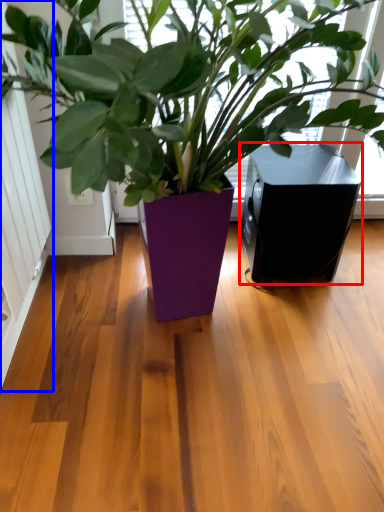
Question: Which of the following is the farthest to the observer, speaker (highlighted by a red box) or screen door (highlighted by a blue box)?

Choices:
 (A) speaker
 (B) screen door

Answer: (A)